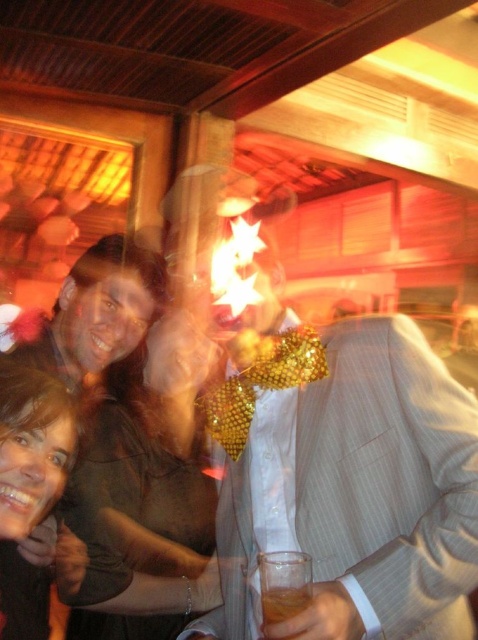
Question: Which point is farther from the camera taking this photo?

Choices:
 (A) (72, 291)
 (B) (351, 536)
 (C) (276, 586)
 (D) (10, 552)

Answer: (A)

Question: Which object is the farthest from the pinstriped suit at center?

Choices:
 (A) matte black dress at center
 (B) translucent amber liquid at lower center
 (C) matte gold star at upper center
 (D) matte brown hair at center

Answer: (A)

Question: Does pinstriped suit at center have a lesser width compared to matte black dress at center?

Choices:
 (A) no
 (B) yes

Answer: (A)

Question: Which point is farther to the camera?

Choices:
 (A) matte brown hair at center
 (B) matte black dress at center
 (C) pinstriped suit at center

Answer: (B)

Question: Does pinstriped suit at center appear under translucent amber liquid at lower center?

Choices:
 (A) no
 (B) yes

Answer: (A)

Question: Is matte gold star at upper center below matte brown hair at center?

Choices:
 (A) no
 (B) yes

Answer: (A)